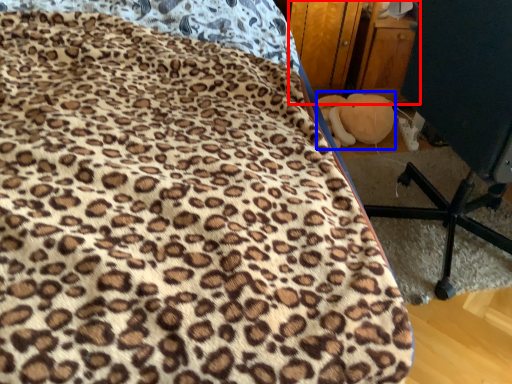
Question: Among these objects, which one is farthest to the camera, dresser (highlighted by a red box) or toy (highlighted by a blue box)?

Choices:
 (A) dresser
 (B) toy

Answer: (B)